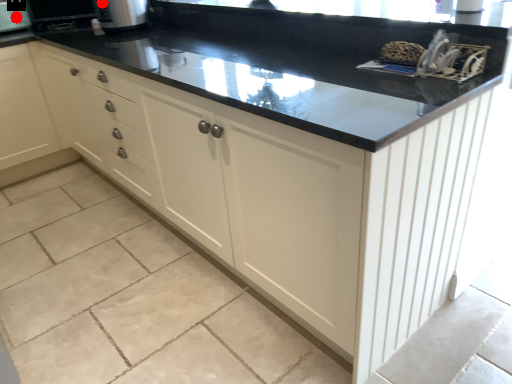
Question: Two points are circled on the image, labeled by A and B beside each circle. Which of the following is the closest to the observer?

Choices:
 (A) A is closer
 (B) B is closer

Answer: (B)